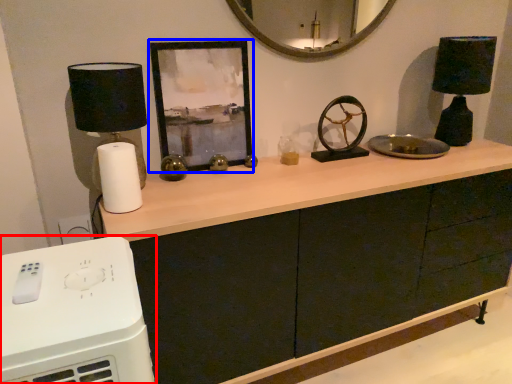
Question: Which point is closer to the camera, home appliance (highlighted by a red box) or picture frame (highlighted by a blue box)?

Choices:
 (A) home appliance
 (B) picture frame

Answer: (A)